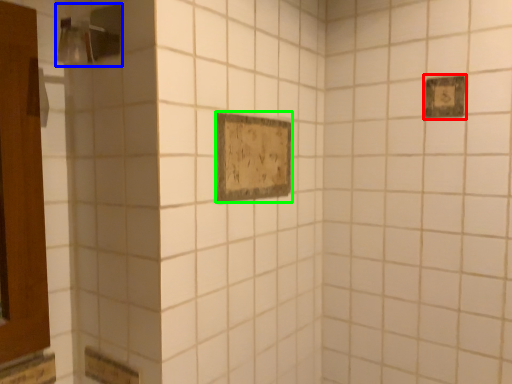
Question: Considering the real-world distances, which object is closest to rectangle (highlighted by a red box)? shower (highlighted by a blue box) or rectangle (highlighted by a green box).

Choices:
 (A) shower
 (B) rectangle

Answer: (B)